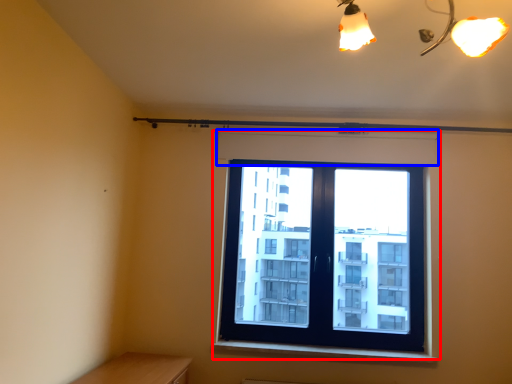
Question: Among these objects, which one is farthest to the camera, window (highlighted by a red box) or shutter (highlighted by a blue box)?

Choices:
 (A) window
 (B) shutter

Answer: (B)